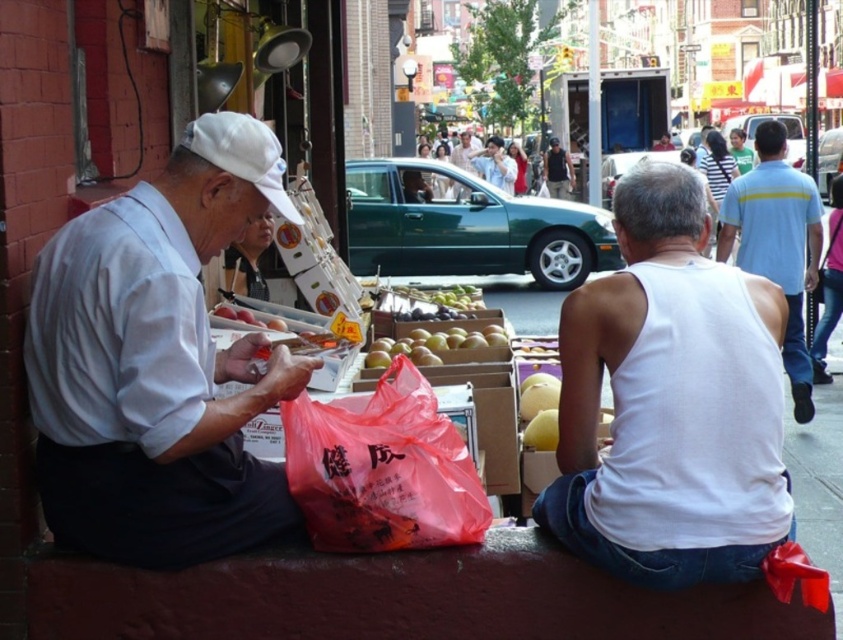
Who is shorter, white matte shirt at left or white cotton tank top at center?

Standing shorter between the two is white cotton tank top at center.

Where is `white matte shirt at left`? The height and width of the screenshot is (640, 843). white matte shirt at left is located at coordinates (158, 364).

This screenshot has height=640, width=843. Identify the location of dark blue jeans at center. (557, 170).

Is dark blue jeans at center shorter than green cotton shirt at upper right?

Indeed, dark blue jeans at center has a lesser height compared to green cotton shirt at upper right.

Where is `dark blue jeans at center`? This screenshot has height=640, width=843. dark blue jeans at center is located at coordinates (557, 170).

Where is `dark blue jeans at center`? The height and width of the screenshot is (640, 843). dark blue jeans at center is located at coordinates (557, 170).

Between point (744, 266) and point (561, 182), which one is positioned behind?

The point (561, 182) is more distant.

Can you confirm if light blue striped shirt at right is shorter than dark blue jeans at center?

In fact, light blue striped shirt at right may be taller than dark blue jeans at center.

Is point (771, 243) positioned after point (546, 152)?

No, it is in front of (546, 152).

Where is `light blue striped shirt at right`? Image resolution: width=843 pixels, height=640 pixels. light blue striped shirt at right is located at coordinates (777, 243).